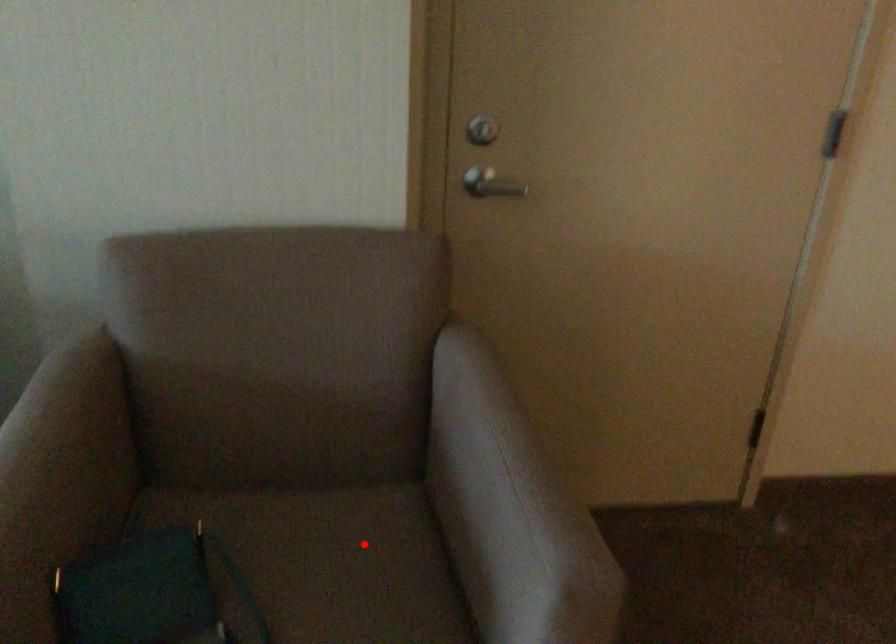
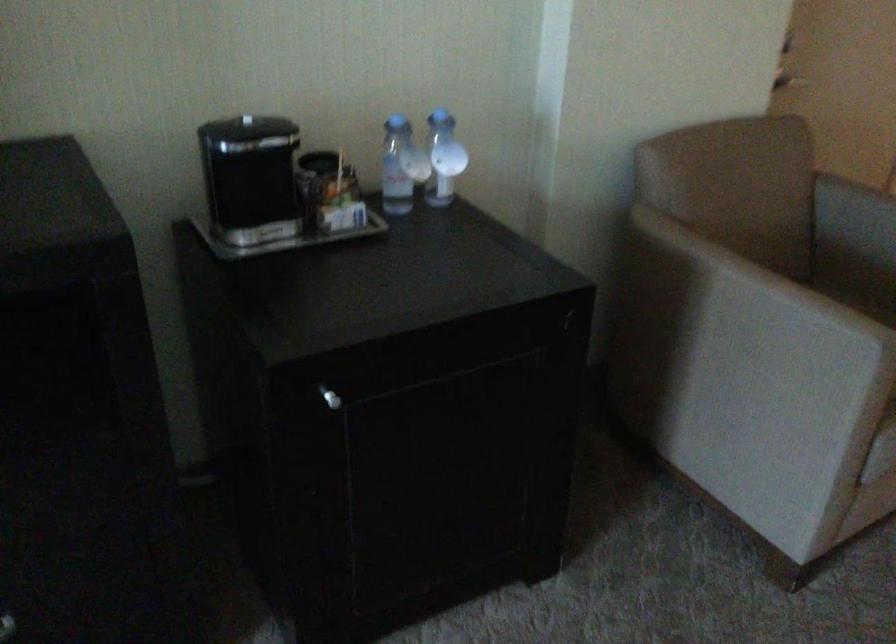
In the second image, find the point that corresponds to the highlighted location in the first image.

(859, 303)